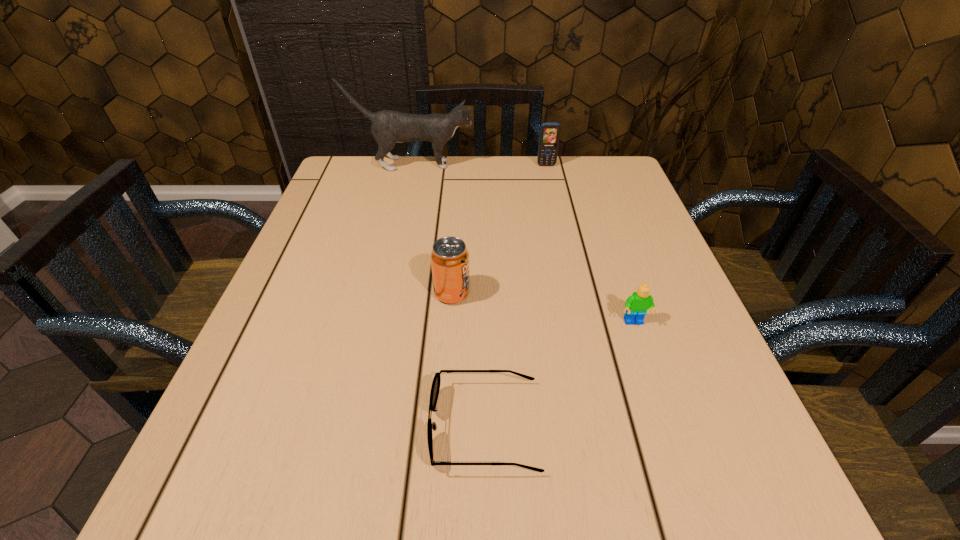
Find the location of `free spot that satisfies the following two spatial constraints: 1. at the face of the cat; 2. on the right side of the soda can`. free spot that satisfies the following two spatial constraints: 1. at the face of the cat; 2. on the right side of the soda can is located at coordinates (382, 293).

This screenshot has width=960, height=540. What are the coordinates of `free space that satisfies the following two spatial constraints: 1. on the back side of the third farthest object; 2. at the face of the tallest object` in the screenshot? It's located at (461, 164).

In order to click on vacant region that satisfies the following two spatial constraints: 1. at the face of the tallest object; 2. on the left side of the third farthest object in this screenshot , I will do tap(382, 293).

I want to click on vacant area in the image that satisfies the following two spatial constraints: 1. on the screen of the cellular telephone; 2. on the front-facing side of the nearest object, so [x=604, y=426].

Where is `free region that satisfies the following two spatial constraints: 1. on the screen of the second object from right to left; 2. on the front-facing side of the shortest object`? The image size is (960, 540). free region that satisfies the following two spatial constraints: 1. on the screen of the second object from right to left; 2. on the front-facing side of the shortest object is located at coordinates (604, 426).

At what (x,y) coordinates should I click in order to perform the action: click on vacant space that satisfies the following two spatial constraints: 1. at the face of the tallest object; 2. on the right side of the soda can. Please return your answer as a coordinate pair (x, y). Image resolution: width=960 pixels, height=540 pixels. Looking at the image, I should click on (382, 293).